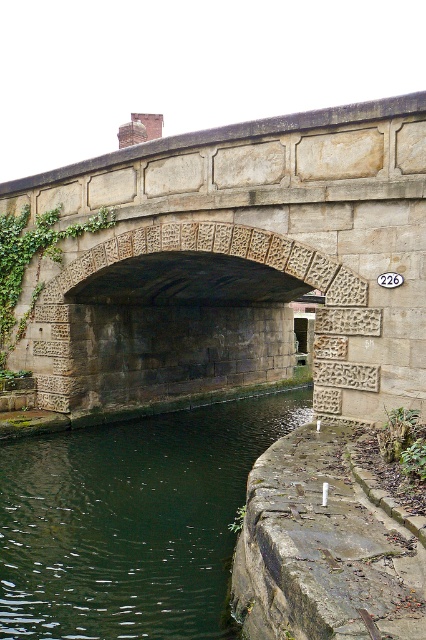
Question: Can you confirm if stone textured bridge at center is positioned below green ivy at center?

Choices:
 (A) no
 (B) yes

Answer: (A)

Question: Which point is closer to the camera?

Choices:
 (A) (245, 291)
 (B) (210, 556)

Answer: (B)

Question: Which point appears closest to the camera in this image?

Choices:
 (A) (19, 227)
 (B) (210, 621)
 (C) (126, 378)

Answer: (B)

Question: Can you confirm if stone textured bridge at center is smaller than green ivy at center?

Choices:
 (A) no
 (B) yes

Answer: (A)

Question: Which object is farther from the camera taking this photo?

Choices:
 (A) green stone water at lower left
 (B) green ivy at center
 (C) stone textured bridge at center

Answer: (B)

Question: Does stone textured bridge at center appear on the left side of green ivy at center?

Choices:
 (A) no
 (B) yes

Answer: (A)